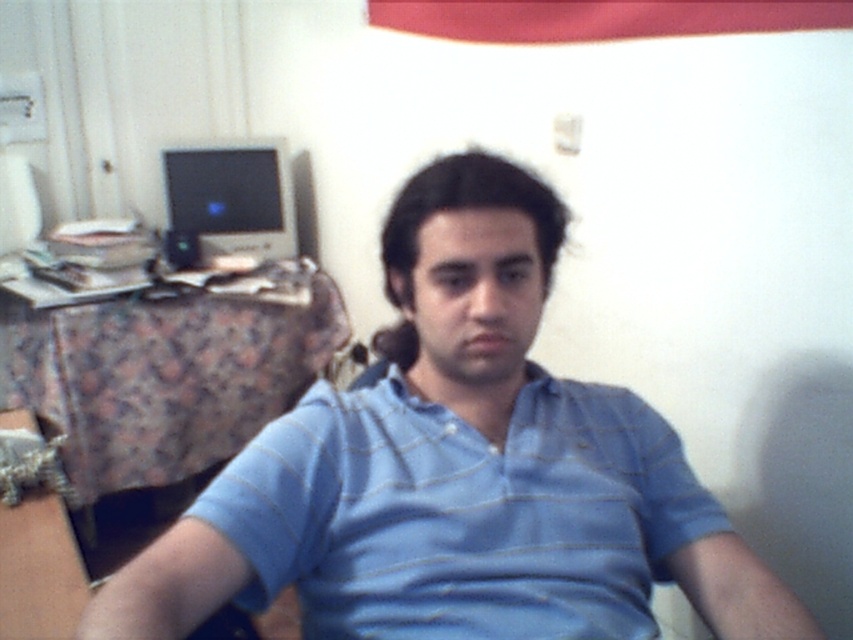
Who is positioned more to the right, blue striped shirt at center or blue striped polo shirt at center?

blue striped polo shirt at center

Who is positioned more to the left, blue striped shirt at center or blue striped polo shirt at center?

Positioned to the left is blue striped shirt at center.

The height and width of the screenshot is (640, 853). Describe the element at coordinates (457, 472) in the screenshot. I see `blue striped shirt at center` at that location.

Locate an element on the screen. blue striped shirt at center is located at coordinates (457, 472).

Can you confirm if blue striped shirt at center is positioned to the right of matte black monitor at left?

Indeed, blue striped shirt at center is positioned on the right side of matte black monitor at left.

What do you see at coordinates (457, 472) in the screenshot? I see `blue striped shirt at center` at bounding box center [457, 472].

Find the location of `blue striped shirt at center`. blue striped shirt at center is located at coordinates (457, 472).

Who is shorter, blue striped polo shirt at center or matte black monitor at left?

With less height is blue striped polo shirt at center.

What do you see at coordinates (463, 515) in the screenshot? I see `blue striped polo shirt at center` at bounding box center [463, 515].

Is point (303, 564) in front of point (259, 241)?

Yes, it is.

This screenshot has height=640, width=853. Find the location of `blue striped polo shirt at center`. blue striped polo shirt at center is located at coordinates (463, 515).